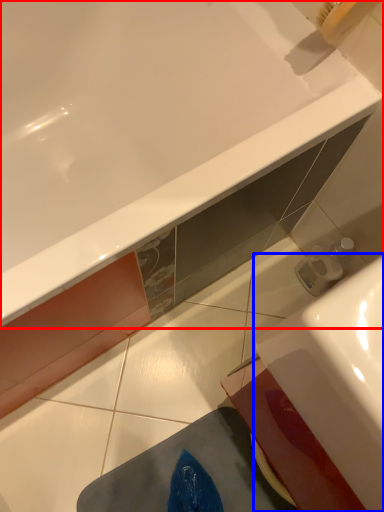
Question: Among these objects, which one is farthest to the camera, bathtub (highlighted by a red box) or sink (highlighted by a blue box)?

Choices:
 (A) bathtub
 (B) sink

Answer: (A)